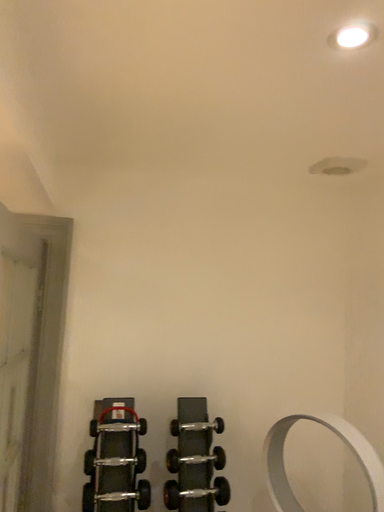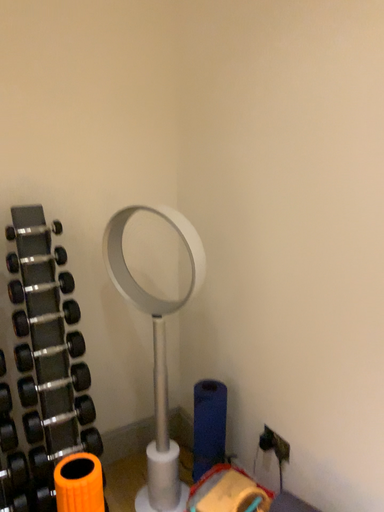
Question: How did the camera likely rotate when shooting the video?

Choices:
 (A) rotated downward
 (B) rotated upward

Answer: (A)